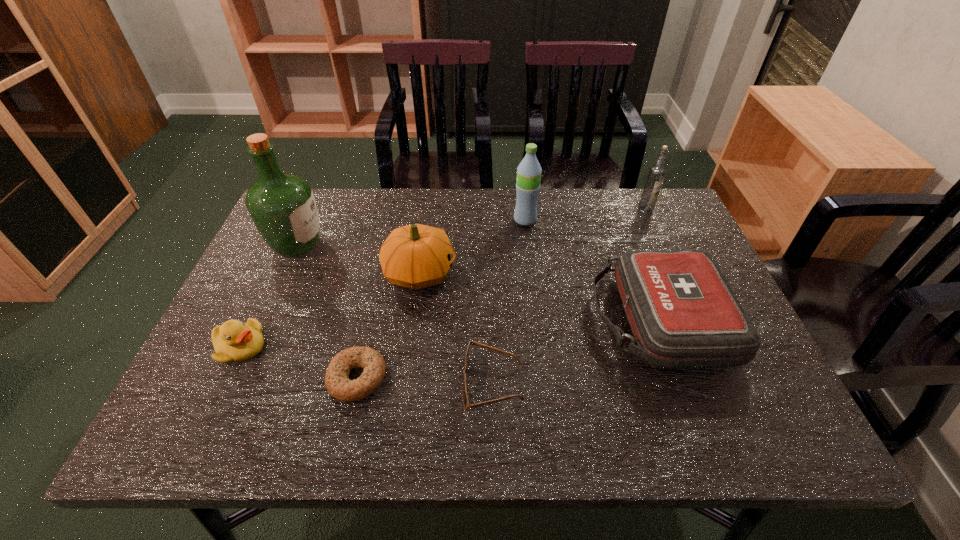
This screenshot has width=960, height=540. What are the coordinates of `free space at the far edge of the desktop` in the screenshot? It's located at (363, 201).

Where is `vacant region at the near edge of the desktop`? The width and height of the screenshot is (960, 540). vacant region at the near edge of the desktop is located at coordinates (608, 444).

This screenshot has height=540, width=960. I want to click on free space at the left edge of the desktop, so click(x=224, y=366).

Where is `vacant area at the far right corner`? The height and width of the screenshot is (540, 960). vacant area at the far right corner is located at coordinates (634, 207).

At what (x,y) coordinates should I click in order to perform the action: click on vacant space that is in between the gourd and the fifth object from left to right. Please return your answer as a coordinate pair (x, y). The width and height of the screenshot is (960, 540). Looking at the image, I should click on (456, 328).

Where is `empty location between the vodka and the sunglasses`? This screenshot has height=540, width=960. empty location between the vodka and the sunglasses is located at coordinates (569, 296).

Where is `vacant area that lies between the sixth tallest object and the fourth shortest object`? The height and width of the screenshot is (540, 960). vacant area that lies between the sixth tallest object and the fourth shortest object is located at coordinates 449,334.

What are the coordinates of `vacant space in between the liquor and the vodka` in the screenshot? It's located at (471, 227).

Locate an element on the screen. empty location between the bagel and the vodka is located at coordinates (501, 293).

This screenshot has height=540, width=960. Find the location of `free point between the first-aid kit and the sixth object from left to right`. free point between the first-aid kit and the sixth object from left to right is located at coordinates (591, 270).